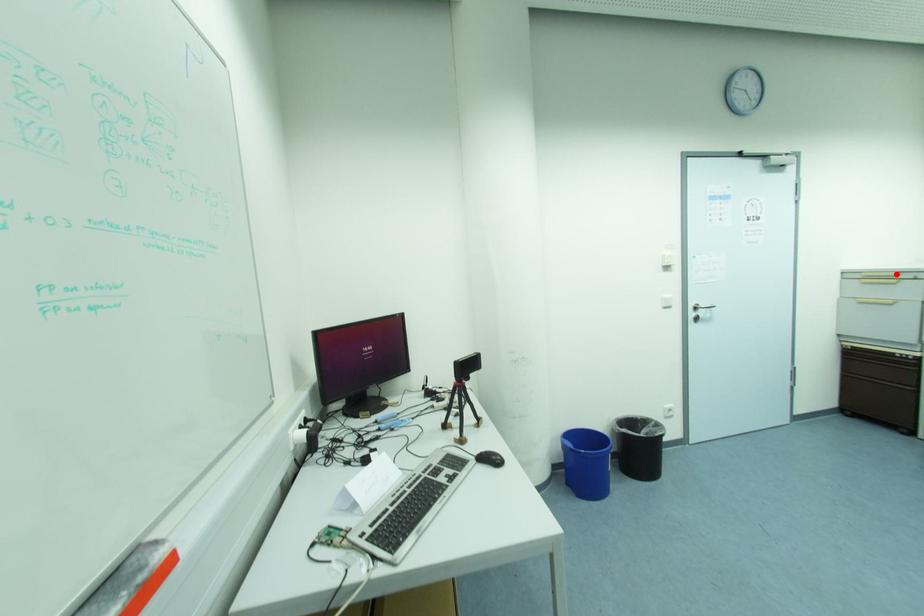
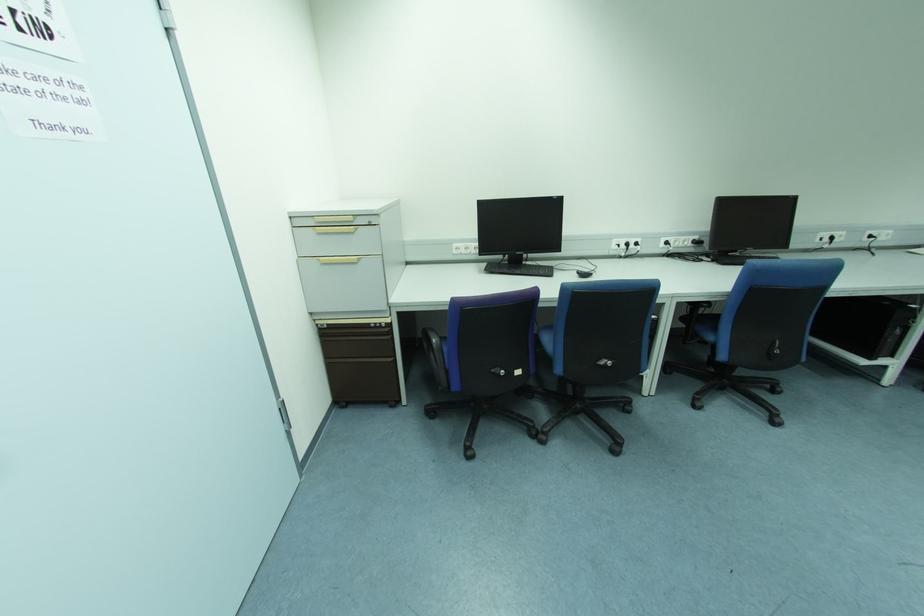
Locate, in the second image, the point that corresponds to the highlighted location in the first image.

(350, 219)